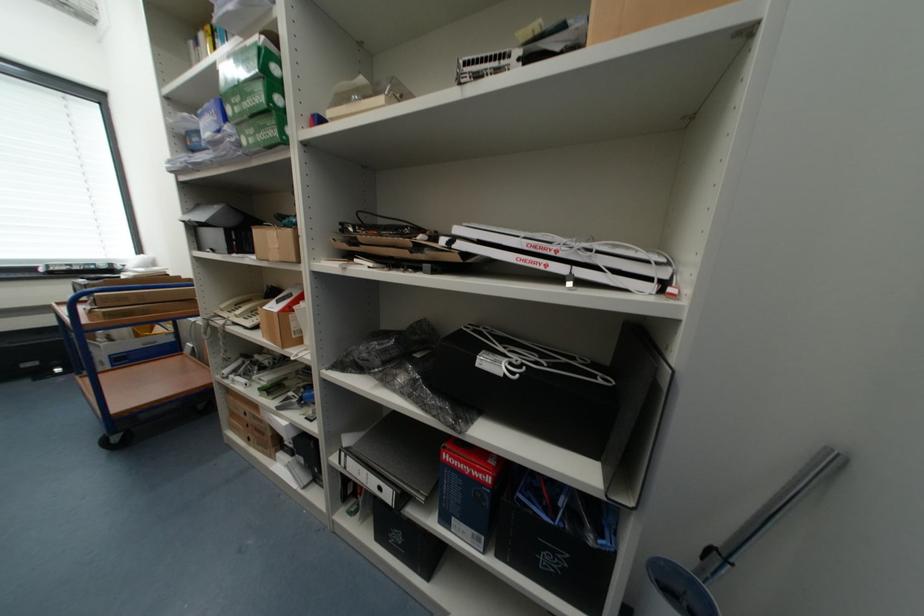
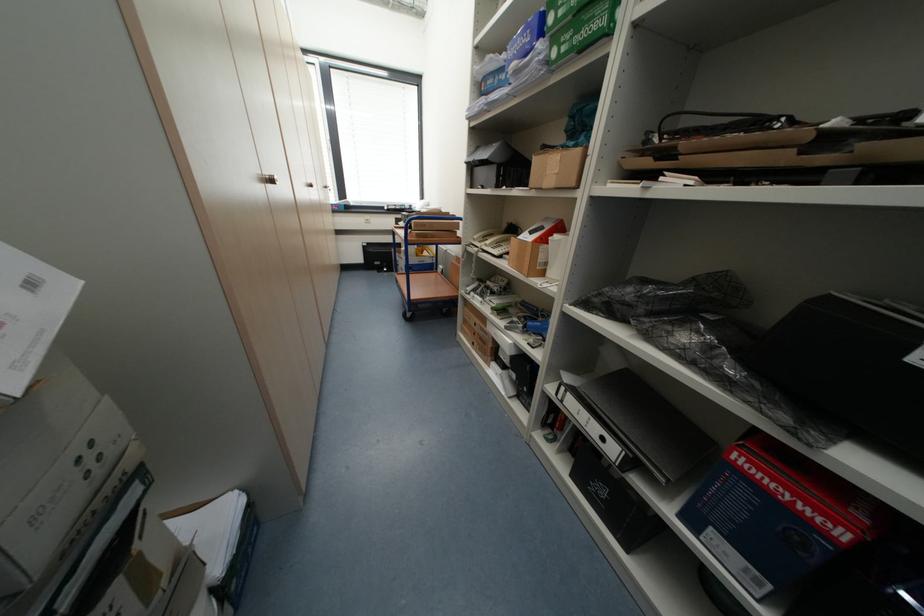
Where in the second image is the point corresponding to (x=258, y=142) from the first image?

(569, 50)